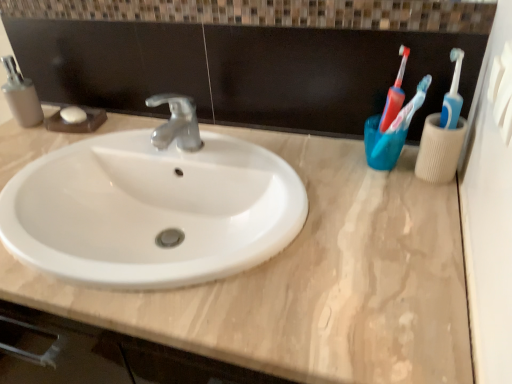
Where is `vacant space situated above beige marble counter top at center (from a real-world perspective)`? The width and height of the screenshot is (512, 384). vacant space situated above beige marble counter top at center (from a real-world perspective) is located at coordinates (230, 173).